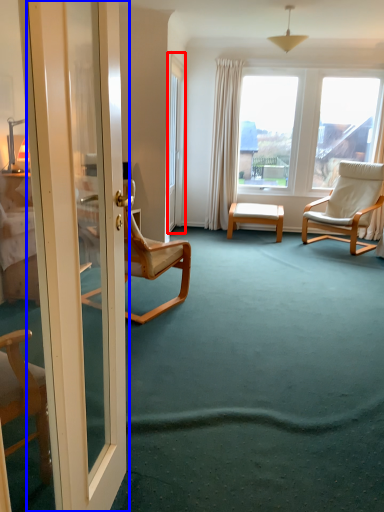
Question: Which of the following is the closest to the observer, glass door (highlighted by a red box) or door (highlighted by a blue box)?

Choices:
 (A) glass door
 (B) door

Answer: (B)